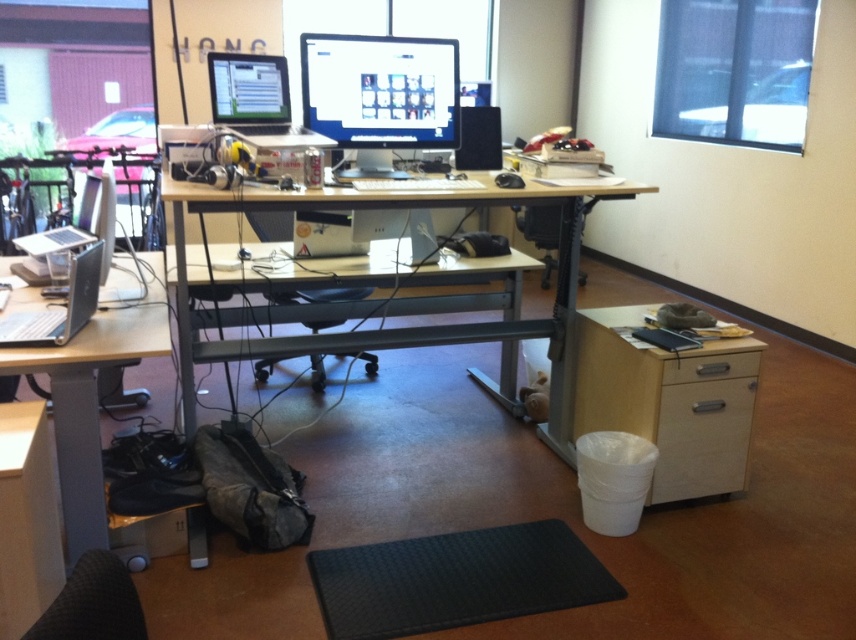
Describe the element at coordinates (669, 401) in the screenshot. I see `wooden cabinet at lower right` at that location.

Is wooden cabinet at lower right shorter than silver metallic laptop at left?

No.

The height and width of the screenshot is (640, 856). I want to click on wooden cabinet at lower right, so click(669, 401).

Is black fabric swivel chair at lower left shorter than black mesh office chair at center?

Yes.

Who is positioned more to the right, black fabric swivel chair at lower left or black mesh office chair at center?

black fabric swivel chair at lower left

Describe the element at coordinates (93, 604) in the screenshot. I see `black fabric swivel chair at lower left` at that location.

Where is `black fabric swivel chair at lower left`? black fabric swivel chair at lower left is located at coordinates (93, 604).

Can you confirm if black rubber yoga mat at lower center is positioned above matte black monitor at upper center?

Incorrect, black rubber yoga mat at lower center is not positioned above matte black monitor at upper center.

Between black rubber yoga mat at lower center and matte black monitor at upper center, which one appears on the left side from the viewer's perspective?

From the viewer's perspective, matte black monitor at upper center appears more on the left side.

Who is more distant from viewer, (535, 580) or (260, 120)?

Point (260, 120)

At what (x,y) coordinates should I click in order to perform the action: click on black rubber yoga mat at lower center. Please return your answer as a coordinate pair (x, y). Looking at the image, I should click on (455, 579).